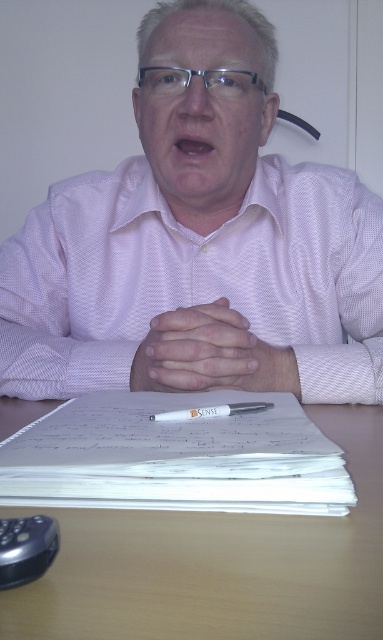
Identify the location of pink textured shirt at center. The width and height of the screenshot is (383, 640). (199, 246).

Find the location of a particular element. pink textured shirt at center is located at coordinates (199, 246).

Does smooth skin hands at center appear under black plastic mouse at lower left?

Incorrect, smooth skin hands at center is not positioned below black plastic mouse at lower left.

Does smooth skin hands at center have a smaller size compared to black plastic mouse at lower left?

No.

Which is in front, point (206, 381) or point (1, 552)?

Point (1, 552)

Image resolution: width=383 pixels, height=640 pixels. I want to click on smooth skin hands at center, so click(194, 349).

Can you confirm if light brown wooden table at center is positioned below white plastic pen at center?

Indeed, light brown wooden table at center is positioned under white plastic pen at center.

Does light brown wooden table at center lie behind white plastic pen at center?

No, light brown wooden table at center is closer to the viewer.

Between point (284, 582) and point (250, 403), which one is positioned in front?

Point (284, 582) is in front.

Find the location of a particular element. light brown wooden table at center is located at coordinates (217, 564).